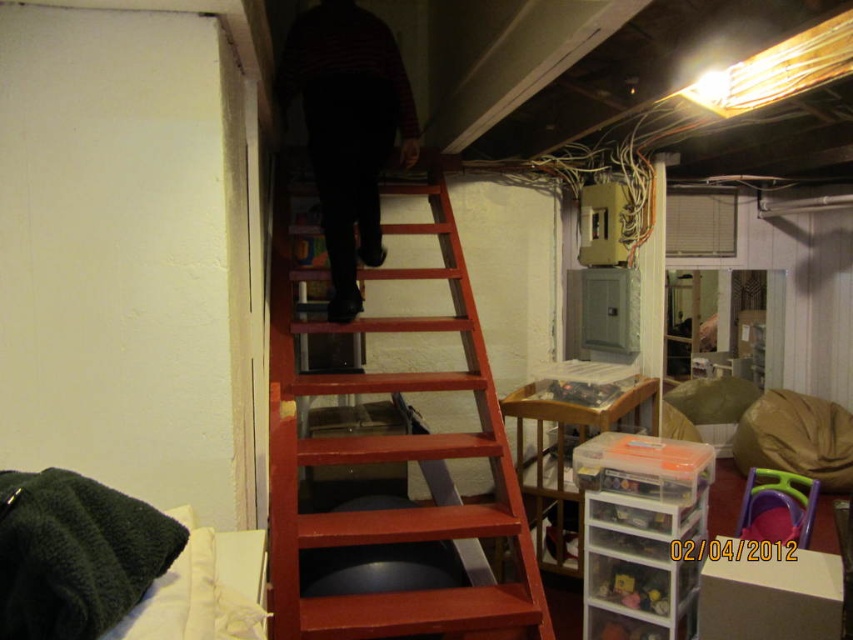
You are trying to reach the lofted space above you in the basement. There is a wooden ladder at center and a striped sweater at upper center. Which object should you use to climb up?

You should use the wooden ladder at center to climb up because it is positioned in front of the striped sweater at upper center, making it accessible for climbing.

You are standing in a basement with a wooden ladder at center. If you want to reach the lofted space above, which object should you use?

You should use the wooden ladder at center to reach the lofted space above.

You are trying to reach the lofted space above. The wooden ladder at center and the striped sweater at upper center are in your way. Which one should you move to access the loft?

The striped sweater at upper center is much shorter than the wooden ladder at center, so you should move the striped sweater at upper center to access the loft.